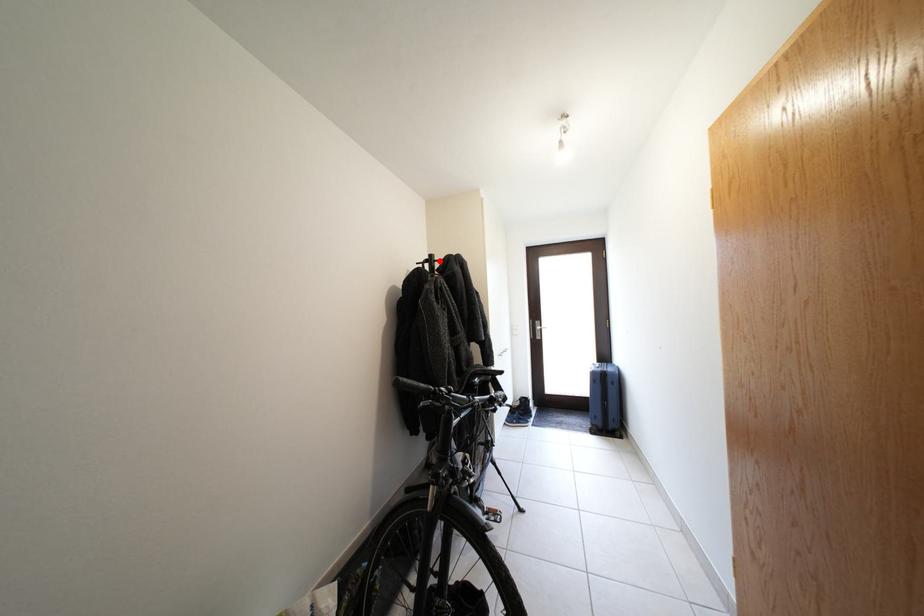
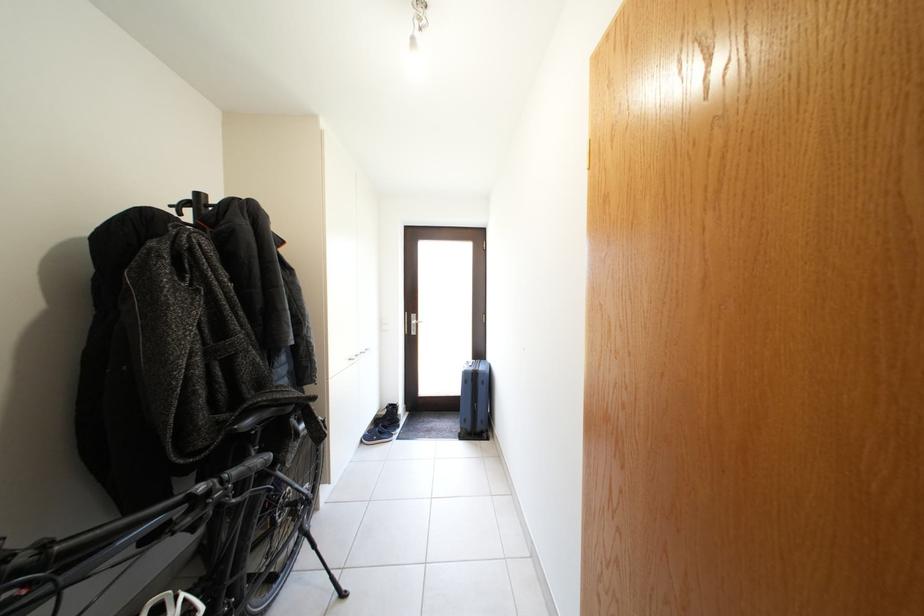
The point at the highlighted location is marked in the first image. Where is the corresponding point in the second image?

(205, 200)